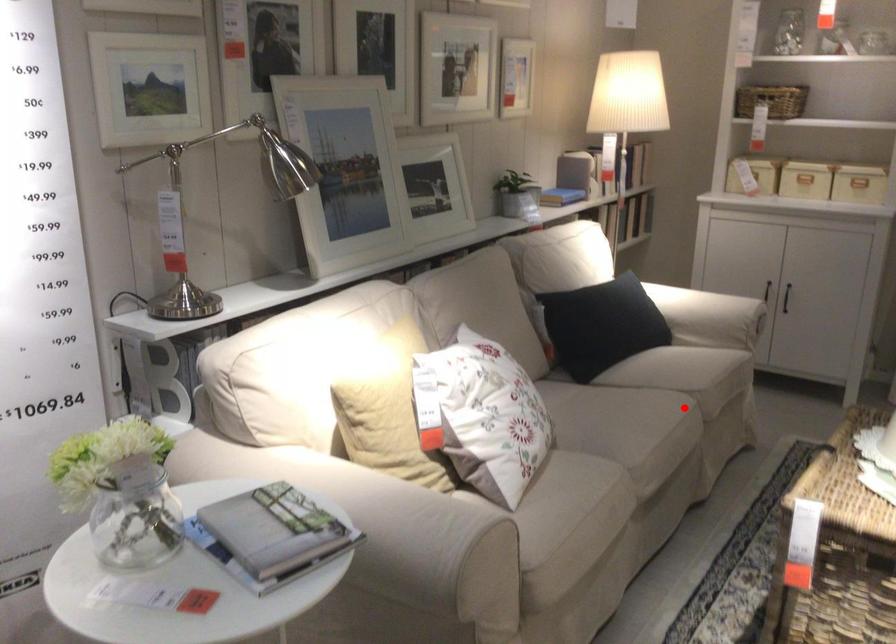
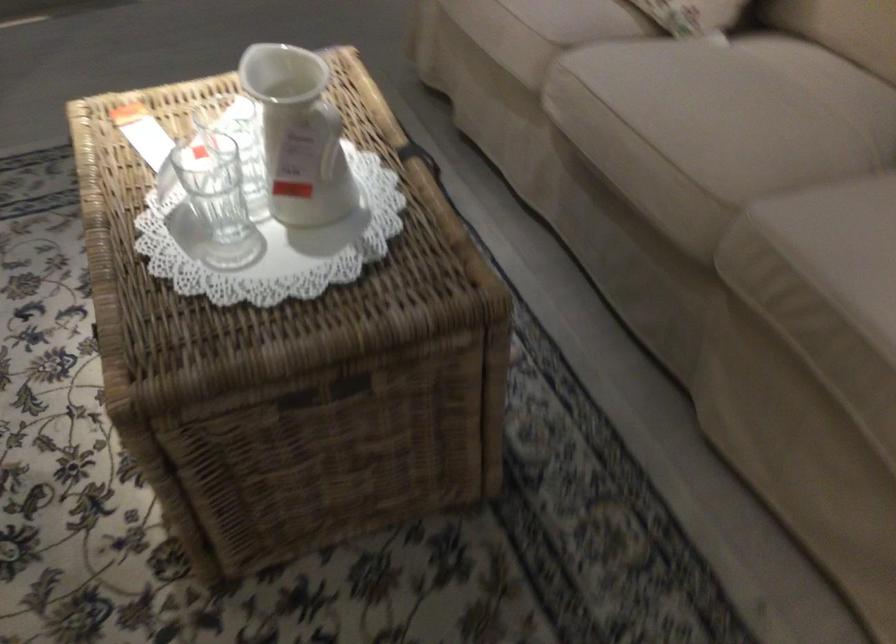
Locate, in the second image, the point that corresponds to the highlighted location in the first image.

(704, 167)